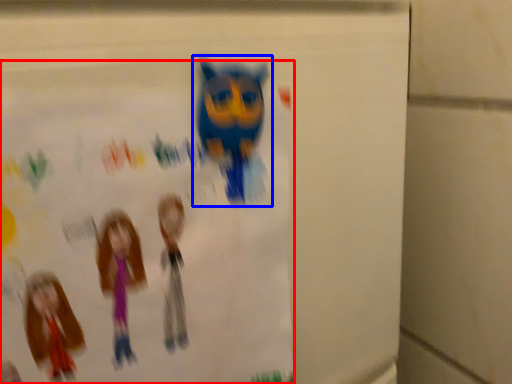
Question: Which object is further to the camera taking this photo, poster (highlighted by a red box) or toy (highlighted by a blue box)?

Choices:
 (A) poster
 (B) toy

Answer: (B)